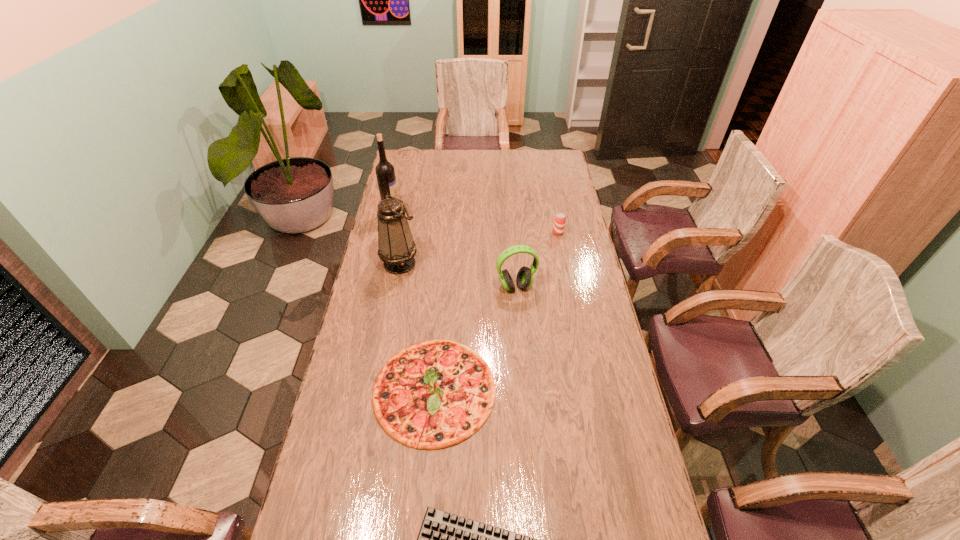
This screenshot has width=960, height=540. I want to click on vacant space located on the front of the fourth shortest object, so click(523, 380).

This screenshot has width=960, height=540. I want to click on free location located 0.260m on the front of the fourth tallest object, so click(x=566, y=278).

This screenshot has width=960, height=540. Identify the location of vacant area situated on the front of the second nearest object. (427, 480).

You are a GUI agent. You are given a task and a screenshot of the screen. Output one action in this format:
    pyautogui.click(x=<x>, y=<y>)
    Task: Click on the wine bottle that is at the left edge
    Image resolution: width=960 pixels, height=540 pixels.
    Given the screenshot: What is the action you would take?
    pyautogui.click(x=385, y=173)

In order to click on oil lamp that is at the left edge in this screenshot , I will do `click(396, 248)`.

Find the location of `pizza located in the left edge section of the desktop`. pizza located in the left edge section of the desktop is located at coordinates (433, 394).

You are a GUI agent. You are given a task and a screenshot of the screen. Output one action in this format:
    pyautogui.click(x=<x>, y=<y>)
    Task: Click on the object at the right edge
    
    Given the screenshot: What is the action you would take?
    pyautogui.click(x=559, y=220)

The height and width of the screenshot is (540, 960). In the image, there is a desktop. What are the coordinates of `vacant region at the far edge` in the screenshot? It's located at (468, 161).

In the image, there is a desktop. Identify the location of vacant area at the left edge. (349, 383).

Image resolution: width=960 pixels, height=540 pixels. Identify the location of vacant area at the right edge. (569, 199).